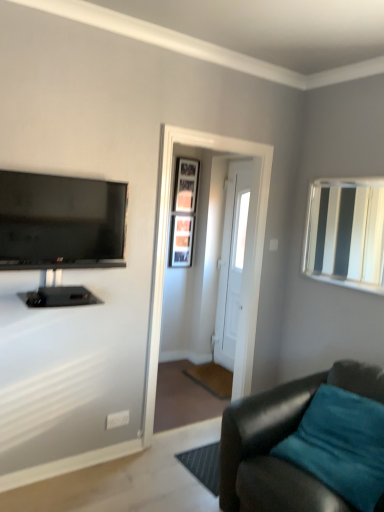
Question: From their relative heights in the image, would you say teal leather couch at lower right is taller or shorter than wooden picture frame at center, which is the 2th picture frame from top to bottom?

Choices:
 (A) tall
 (B) short

Answer: (B)

Question: Is teal leather couch at lower right inside the boundaries of wooden picture frame at center, which is the 2th picture frame from top to bottom, or outside?

Choices:
 (A) inside
 (B) outside

Answer: (B)

Question: Which object is the farthest from the wooden picture frame at center, which is the 2th picture frame from top to bottom?

Choices:
 (A) teal leather couch at lower right
 (B) wooden framed picture at center, the 1th picture frame from the top
 (C) white glossy mirror at upper right
 (D) white glossy door at center
 (E) matte black tv at upper left

Answer: (A)

Question: Which object is positioned farthest from the teal leather couch at lower right?

Choices:
 (A) white wooden door at center
 (B) wooden framed picture at center, the 1th picture frame from the top
 (C) wooden picture frame at center, which is the 2th picture frame from top to bottom
 (D) white glossy door at center
 (E) white glossy mirror at upper right

Answer: (B)